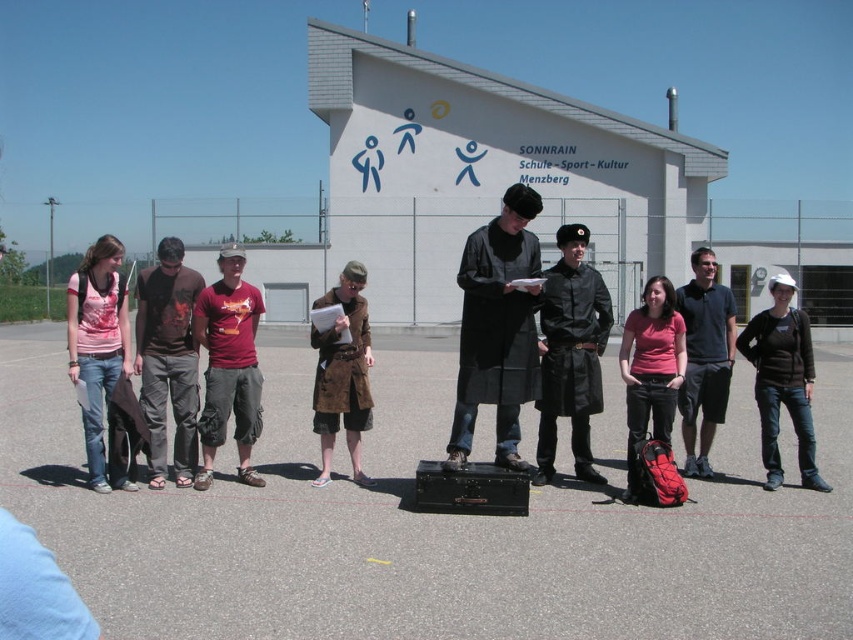
Question: Which object is positioned farthest from the dark brown leather pants at center left?

Choices:
 (A) black leather coat at center
 (B) matte red t-shirt at center

Answer: (A)

Question: Observing the image, what is the correct spatial positioning of matte black coat at center in reference to white matte baseball cap at center?

Choices:
 (A) above
 (B) below

Answer: (A)

Question: Which point is closer to the camera?

Choices:
 (A) brown leather jacket at center
 (B) matte pink shirt at center
 (C) matte red t-shirt at center
 (D) white matte baseball cap at center

Answer: (C)

Question: Does pink cotton shirt at left appear on the right side of brown leather jacket at center?

Choices:
 (A) yes
 (B) no

Answer: (B)

Question: Which of the following is the farthest from the observer?

Choices:
 (A) pink cotton shirt at left
 (B) matte pink shirt at center
 (C) white matte baseball cap at center

Answer: (C)

Question: Is white matte baseball cap at center positioned at the back of matte pink shirt at center?

Choices:
 (A) no
 (B) yes

Answer: (B)